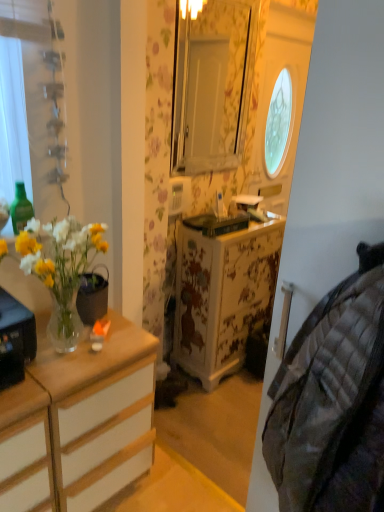
The height and width of the screenshot is (512, 384). I want to click on vacant point above white wood dresser at left, the first cabinetry viewed from the right (from a real-world perspective), so click(91, 340).